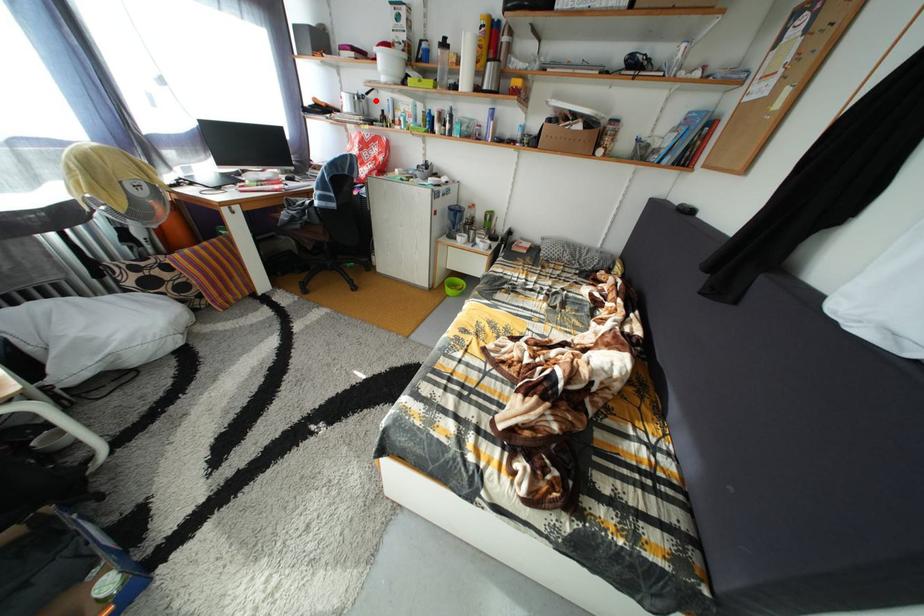
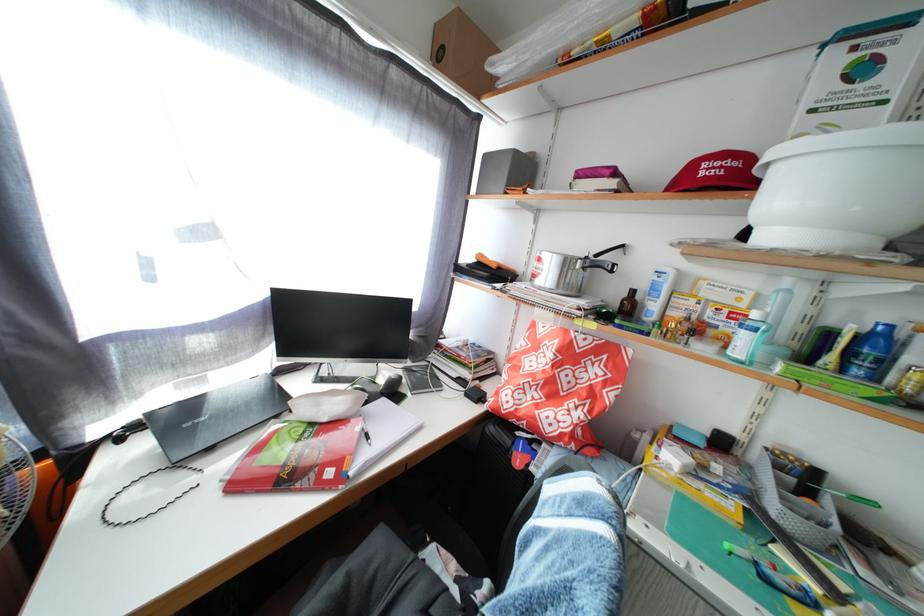
Locate, in the second image, the point that corresponds to the highlighted location in the first image.

(605, 262)